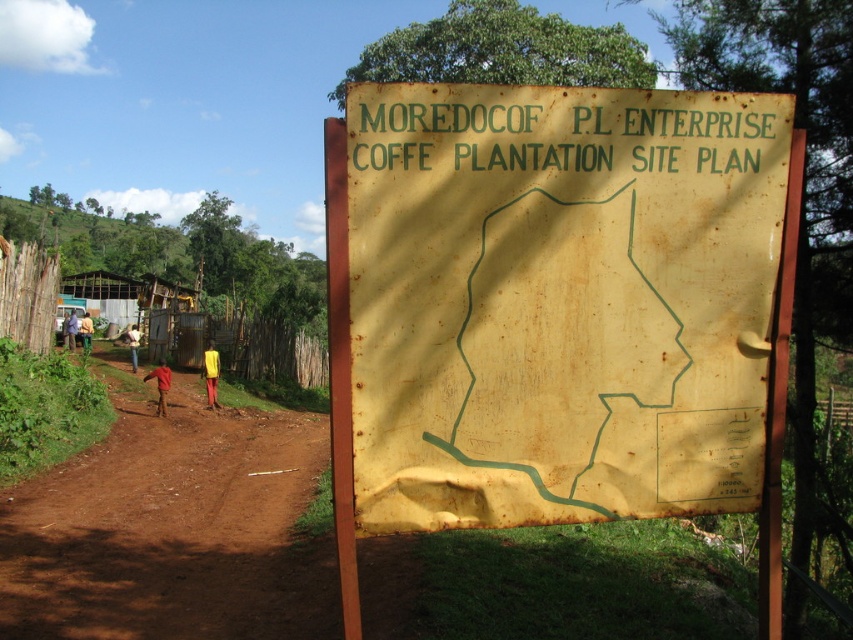
You are a traveler standing in front of the signboard and want to greet the people wearing the red cotton shirt at lower left and the yellow shirt at left who are walking along the dirt path. Which person should you approach first if you want to greet the taller individual?

The red cotton shirt at lower left is larger than the yellow shirt at left, so you should approach the person wearing the red cotton shirt at lower left first since they are taller.

You are a tourist standing in front of the signboard. You notice two people walking along the dirt path in the background. The red cotton shirt at lower left and the yellow shirt at left. Which of the two is shorter?

The red cotton shirt at lower left is shorter than the yellow shirt at left.

Looking at this image, you are a traveler trying to decide whether to walk along the brown dirt track at lower left or wear the yellow fabric shirt at center. Which option allows for more space?

The yellow fabric shirt at center allows for more space because its width is greater than the brown dirt track at lower left.